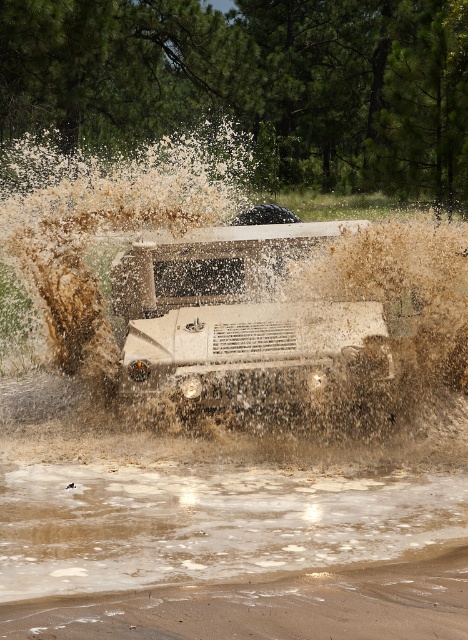
Does brown muddy water at lower center have a greater width compared to white matte jeep at center?

Correct, the width of brown muddy water at lower center exceeds that of white matte jeep at center.

Between brown muddy water at lower center and white matte jeep at center, which one is positioned higher?

white matte jeep at center

Find the location of a particular element. The width and height of the screenshot is (468, 640). brown muddy water at lower center is located at coordinates (209, 522).

Which is more to the right, white matte jeep at center or brown sandy dirt track at lower center?

From the viewer's perspective, brown sandy dirt track at lower center appears more on the right side.

Does white matte jeep at center have a lesser width compared to brown sandy dirt track at lower center?

No.

At what (x,y) coordinates should I click in order to perform the action: click on white matte jeep at center. Please return your answer as a coordinate pair (x, y). The width and height of the screenshot is (468, 640). Looking at the image, I should click on (241, 321).

The image size is (468, 640). In order to click on white matte jeep at center in this screenshot , I will do `click(241, 321)`.

Who is lower down, brown muddy water at lower center or brown sandy dirt track at lower center?

Positioned lower is brown sandy dirt track at lower center.

Which is more to the left, brown muddy water at lower center or brown sandy dirt track at lower center?

From the viewer's perspective, brown muddy water at lower center appears more on the left side.

Describe the element at coordinates (209, 522) in the screenshot. I see `brown muddy water at lower center` at that location.

This screenshot has height=640, width=468. What are the coordinates of `brown muddy water at lower center` in the screenshot? It's located at point(209,522).